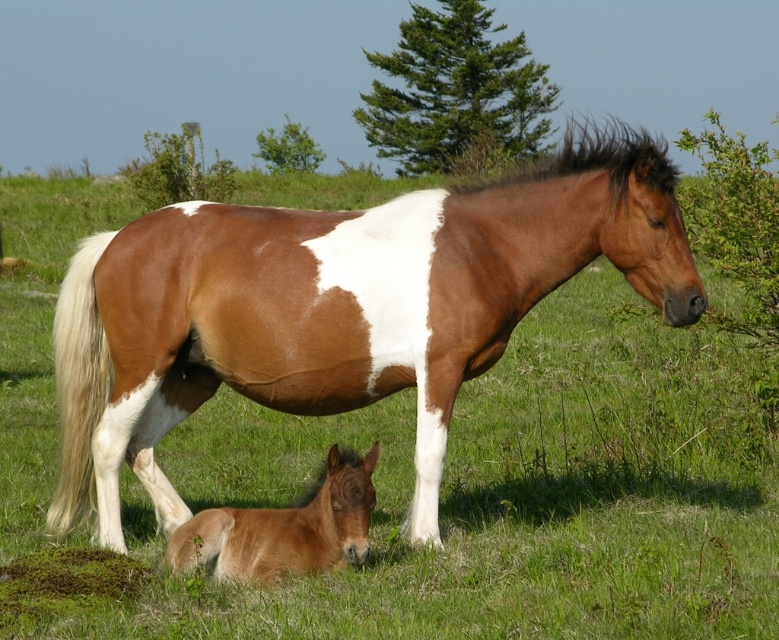
Is brown glossy horse at center smaller than brown matte foal at lower left?

Correct, brown glossy horse at center occupies less space than brown matte foal at lower left.

From the picture: Between brown glossy horse at center and brown matte foal at lower left, which one appears on the left side from the viewer's perspective?

brown matte foal at lower left

This screenshot has width=779, height=640. Describe the element at coordinates (339, 308) in the screenshot. I see `brown glossy horse at center` at that location.

This screenshot has width=779, height=640. Identify the location of brown glossy horse at center. (339, 308).